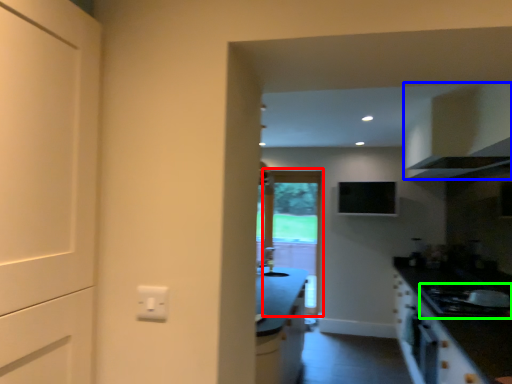
Question: Which is farther away from screen door (highlighted by a red box)? cabinetry (highlighted by a blue box) or gas stove (highlighted by a green box)?

Choices:
 (A) cabinetry
 (B) gas stove

Answer: (B)